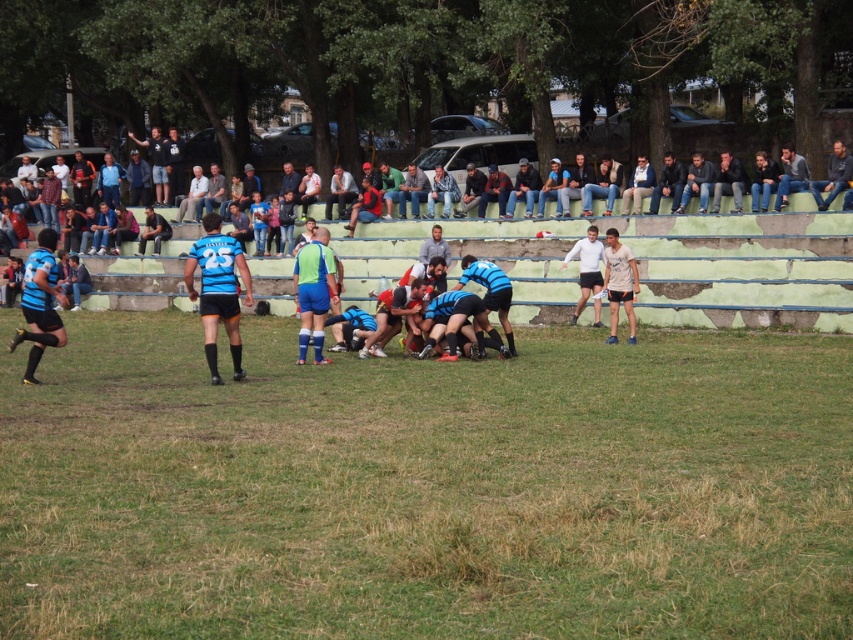
Is green grass at center shorter than jeans at upper right?

No.

The height and width of the screenshot is (640, 853). I want to click on green grass at center, so [x=427, y=488].

The height and width of the screenshot is (640, 853). In order to click on green grass at center in this screenshot , I will do `click(427, 488)`.

Which is more to the left, matte blue jersey at center or white matte shirt at center?

From the viewer's perspective, matte blue jersey at center appears more on the left side.

Does matte blue jersey at center appear over white matte shirt at center?

No.

Does point (206, 321) come closer to viewer compared to point (595, 301)?

Yes, it is.

The width and height of the screenshot is (853, 640). Find the location of `matte blue jersey at center`. matte blue jersey at center is located at coordinates (218, 291).

Measure the distance between blue matte rugby ball at center and camera.

blue matte rugby ball at center and camera are 18.65 meters apart from each other.

Which is more to the right, blue matte rugby ball at center or white matte shirt at center?

Positioned to the right is white matte shirt at center.

Is point (471, 259) in front of point (595, 232)?

Yes, it is in front of point (595, 232).

You are a GUI agent. You are given a task and a screenshot of the screen. Output one action in this format:
    pyautogui.click(x=<x>, y=<y>)
    Task: Click on the blue matte rugby ball at center
    Image resolution: width=853 pixels, height=640 pixels.
    Given the screenshot: What is the action you would take?
    pyautogui.click(x=490, y=291)